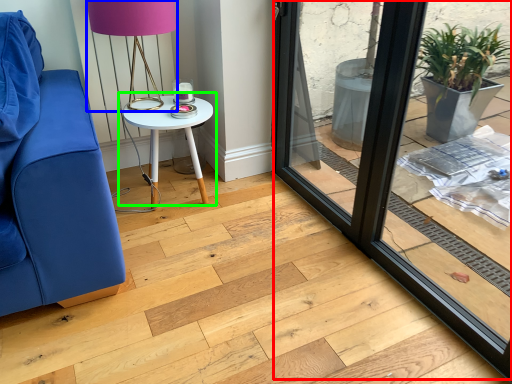
Question: Which object is positioned farthest from window frame (highlighted by a red box)? Select from table lamp (highlighted by a blue box) and table (highlighted by a green box).

Choices:
 (A) table lamp
 (B) table

Answer: (A)